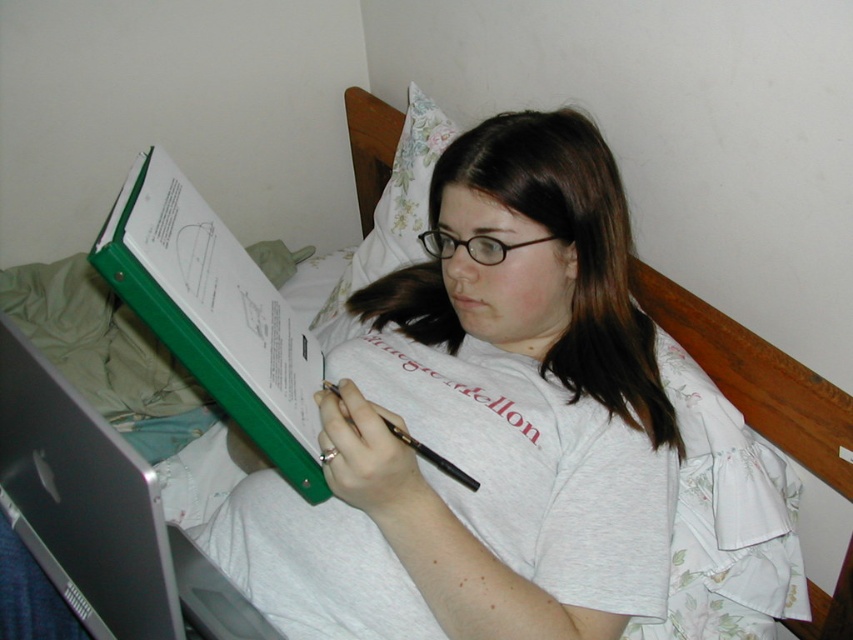
Between point (171, 330) and point (450, 472), which one is positioned behind?

Point (450, 472)

Which is more to the right, green plastic folder at upper left or black plastic pen at center?

black plastic pen at center is more to the right.

Between point (119, 250) and point (437, 468), which one is positioned in front?

Point (119, 250) is in front.

At what (x,y) coordinates should I click in order to perform the action: click on green plastic folder at upper left. Please return your answer as a coordinate pair (x, y). The height and width of the screenshot is (640, 853). Looking at the image, I should click on (215, 314).

Measure the distance from green plastic folder at upper left to black plastic glasses at center.

green plastic folder at upper left and black plastic glasses at center are 9.81 inches apart from each other.

Who is more distant from viewer, (235, 397) or (469, 241)?

The point (469, 241) is behind.

Image resolution: width=853 pixels, height=640 pixels. In order to click on green plastic folder at upper left in this screenshot , I will do `click(215, 314)`.

Can you confirm if black plastic glasses at center is wider than black plastic pen at center?

In fact, black plastic glasses at center might be narrower than black plastic pen at center.

In the scene shown: Who is positioned more to the right, black plastic glasses at center or black plastic pen at center?

black plastic glasses at center is more to the right.

Is point (477, 240) farther from camera compared to point (463, 484)?

That is True.

At what (x,y) coordinates should I click in order to perform the action: click on black plastic glasses at center. Please return your answer as a coordinate pair (x, y). This screenshot has width=853, height=640. Looking at the image, I should click on (471, 244).